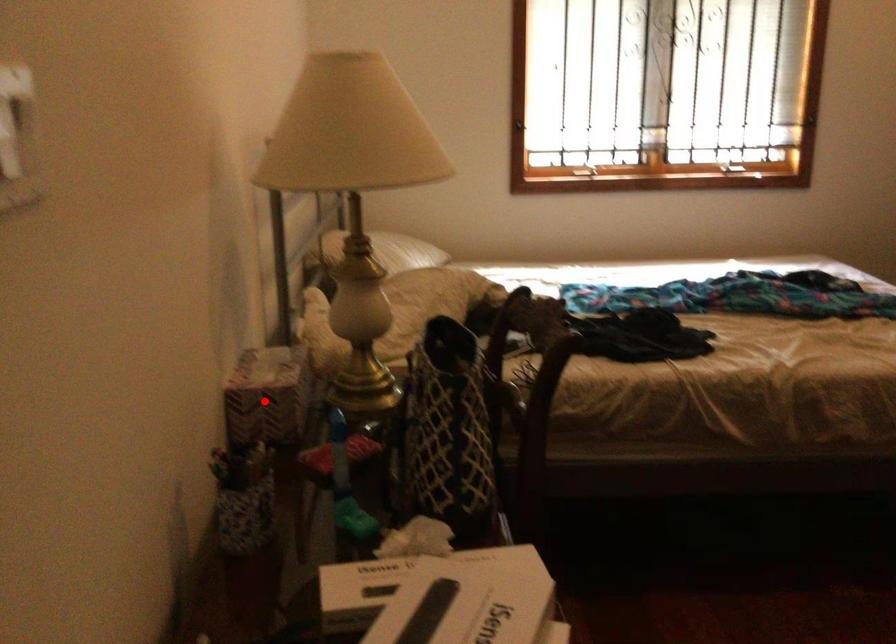
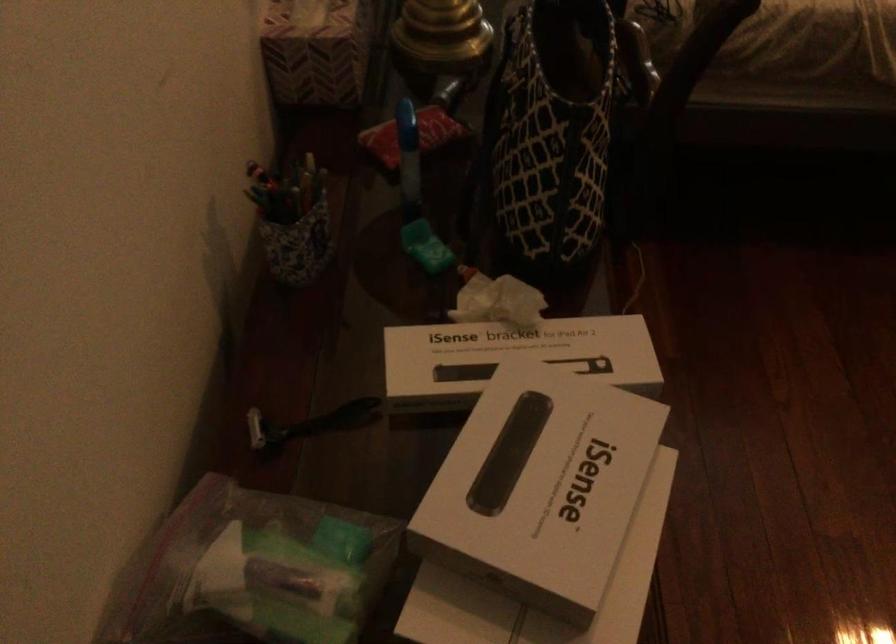
Question: I am providing you with two images of the same scene from different viewpoints. A red point is marked on the first image. Is the red point's position out of view in image 2?

Choices:
 (A) Yes
 (B) No

Answer: (B)